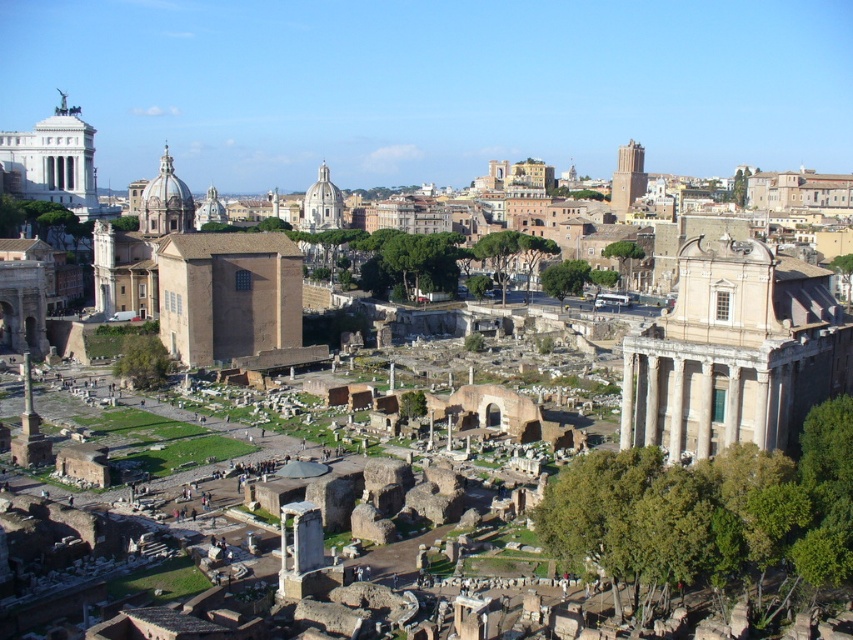
You are a tourist visiting the Roman Forum and want to take a photo that includes both the white marble ruins at center right and the brown brick wall at center. Based on their heights, which object will appear larger in the photo?

The white marble ruins at center right will appear larger in the photo because it is much taller than the brown brick wall at center.

You are a tour guide leading a group through the Roman Forum. You want to point out the white marble ruins at center right and the brown brick wall at center. Which of these two objects is wider?

The white marble ruins at center right might be wider than the brown brick wall at center according to the description.

You are standing at the Roman Forum and want to take a photo of a specific point. The point you want to photograph is located at coordinates point [780,272]. If your camera can focus on objects up to 300 feet away, will it be able to capture that point clearly?

The distance of point [780,272] from camera is 295.19 feet, which is within the camera focus range of 300 feet. Therefore, the camera can capture the point clearly.